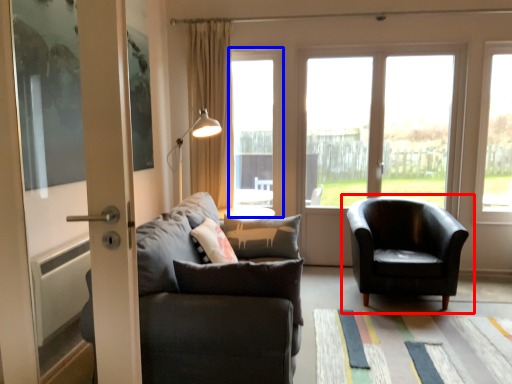
Question: Which of the following is the farthest to the observer, chair (highlighted by a red box) or window (highlighted by a blue box)?

Choices:
 (A) chair
 (B) window

Answer: (B)